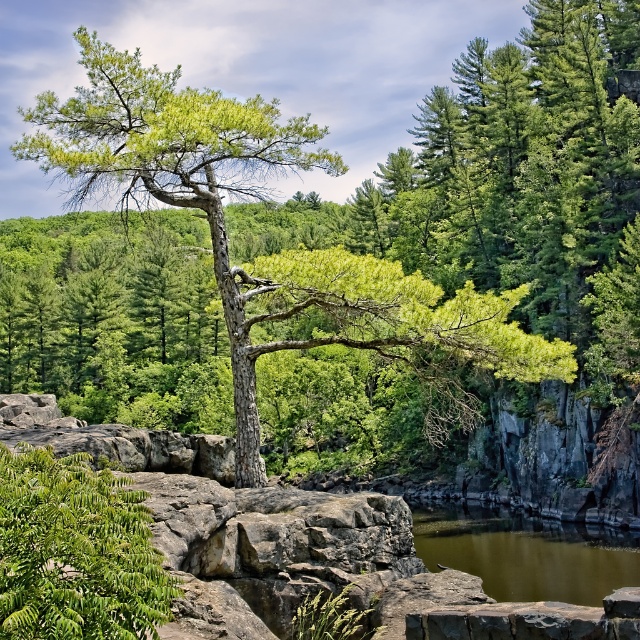
Question: Can you confirm if green textured tree at center is bigger than greenish-brown water at lower center?

Choices:
 (A) no
 (B) yes

Answer: (B)

Question: Can you confirm if green textured tree at center is thinner than greenish-brown water at lower center?

Choices:
 (A) yes
 (B) no

Answer: (B)

Question: Is the position of green textured tree at center more distant than that of greenish-brown water at lower center?

Choices:
 (A) no
 (B) yes

Answer: (B)

Question: Which of the following is the farthest from the observer?

Choices:
 (A) (49, 96)
 (B) (577, 540)

Answer: (B)

Question: Which object appears closest to the camera in this image?

Choices:
 (A) greenish-brown water at lower center
 (B) green textured tree at center

Answer: (A)